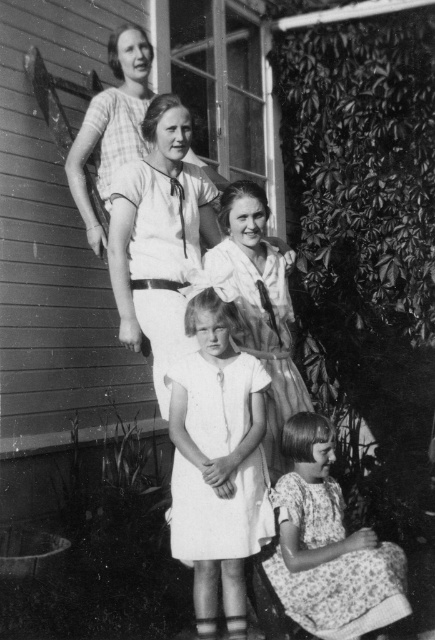
You are a photographer who needs to adjust the lighting for the two dresses in the scene. Since the white cotton dress at center is in front of the draped fabric dress at center, which dress should you focus the light on to ensure both are visible?

The white cotton dress at center is in front of the draped fabric dress at center, so you should focus the light on the white cotton dress at center to ensure both are visible.

You are a fashion designer observing the image and want to create a new collection inspired by the dresses seen. Which dress, the white cotton dress at center or the draped fabric dress at center, would you choose if you want to emphasize verticality in your design?

The white cotton dress at center is taller than the draped fabric dress at center, so choosing the white cotton dress at center would emphasize verticality in the design.